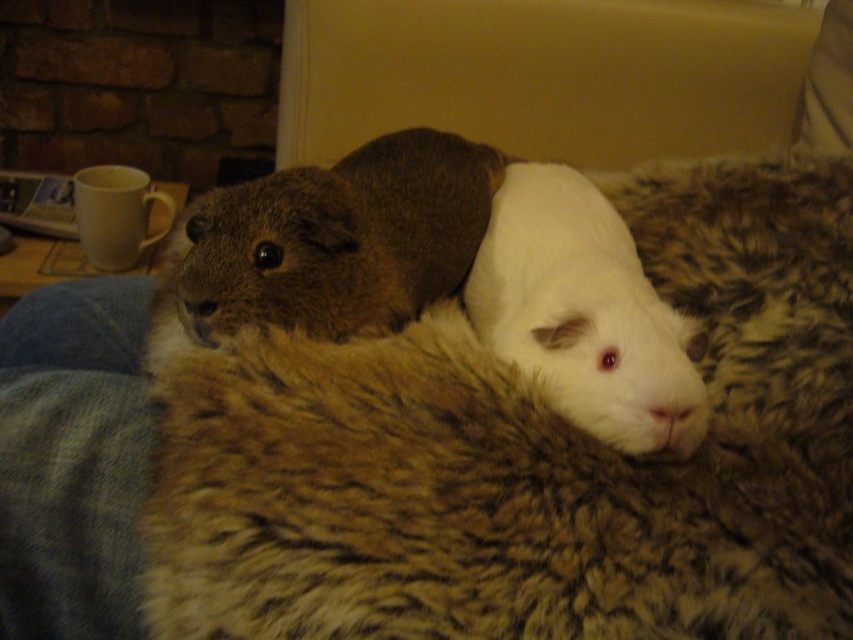
Question: Considering the relative positions of brown fuzzy hamster at upper center and white soft fur hamster at center in the image provided, where is brown fuzzy hamster at upper center located with respect to white soft fur hamster at center?

Choices:
 (A) above
 (B) below

Answer: (A)

Question: Which point is farther to the camera?

Choices:
 (A) (666, 358)
 (B) (281, 198)

Answer: (B)

Question: Does brown fuzzy hamster at upper center have a greater width compared to white soft fur hamster at center?

Choices:
 (A) yes
 (B) no

Answer: (A)

Question: Is brown fuzzy hamster at upper center positioned in front of white soft fur hamster at center?

Choices:
 (A) yes
 (B) no

Answer: (B)